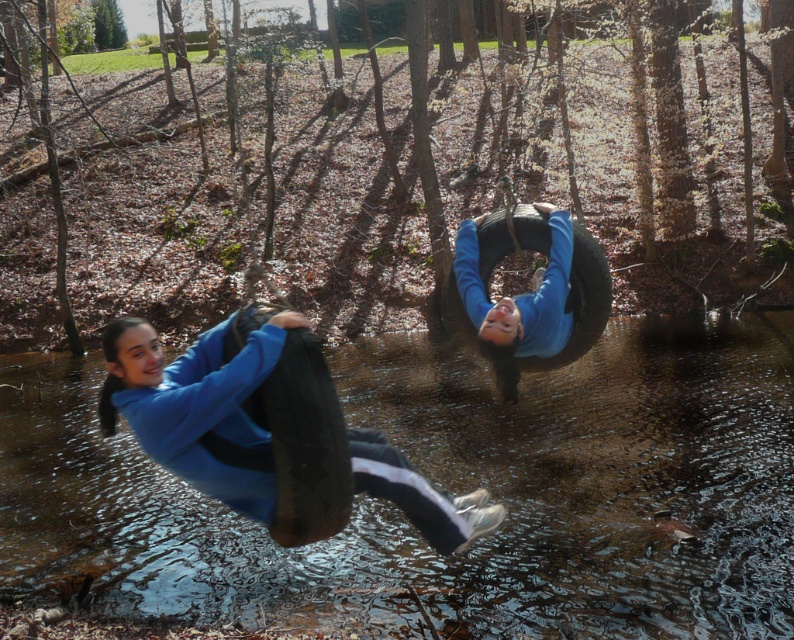
Question: Which point is farther from the camera taking this photo?

Choices:
 (A) (496, 525)
 (B) (557, 317)
 (C) (700, 595)

Answer: (C)

Question: Is clear water at center positioned in front of blue matte jacket at center?

Choices:
 (A) yes
 (B) no

Answer: (B)

Question: Among these points, which one is nearest to the camera?

Choices:
 (A) (472, 250)
 (B) (184, 449)
 (C) (708, 566)

Answer: (B)

Question: Can you confirm if clear water at center is smaller than blue matte tire at center?

Choices:
 (A) yes
 (B) no

Answer: (B)

Question: Which object appears closest to the camera in this image?

Choices:
 (A) blue matte tire at center
 (B) blue matte jacket at center
 (C) clear water at center

Answer: (B)

Question: Is clear water at center wider than blue matte jacket at center?

Choices:
 (A) no
 (B) yes

Answer: (B)